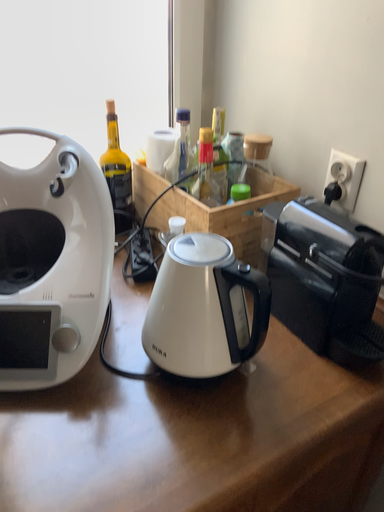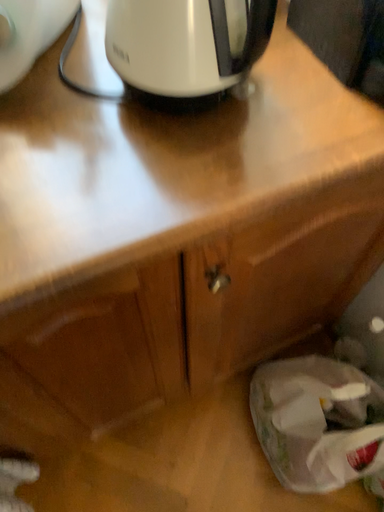
Question: Which way did the camera rotate in the video?

Choices:
 (A) rotated upward
 (B) rotated downward

Answer: (B)